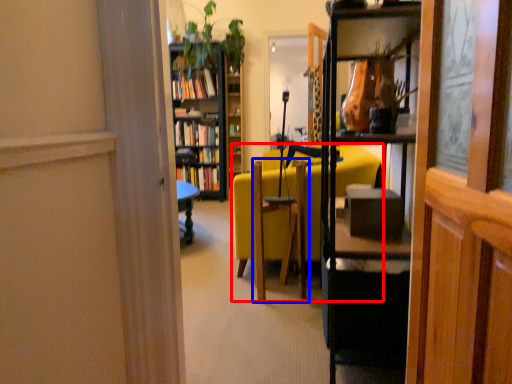
Question: Which object is closer to the camera taking this photo, chair (highlighted by a red box) or swivel chair (highlighted by a blue box)?

Choices:
 (A) chair
 (B) swivel chair

Answer: (B)